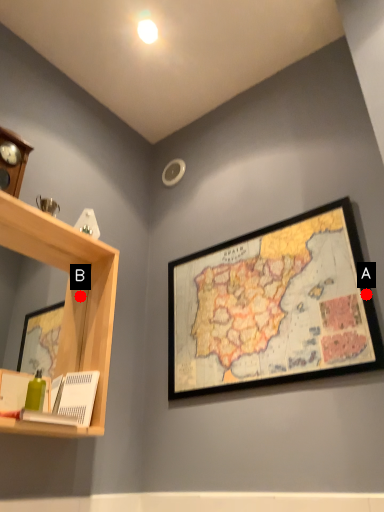
Question: Two points are circled on the image, labeled by A and B beside each circle. Which of the following is the closest to the observer?

Choices:
 (A) A is closer
 (B) B is closer

Answer: (A)